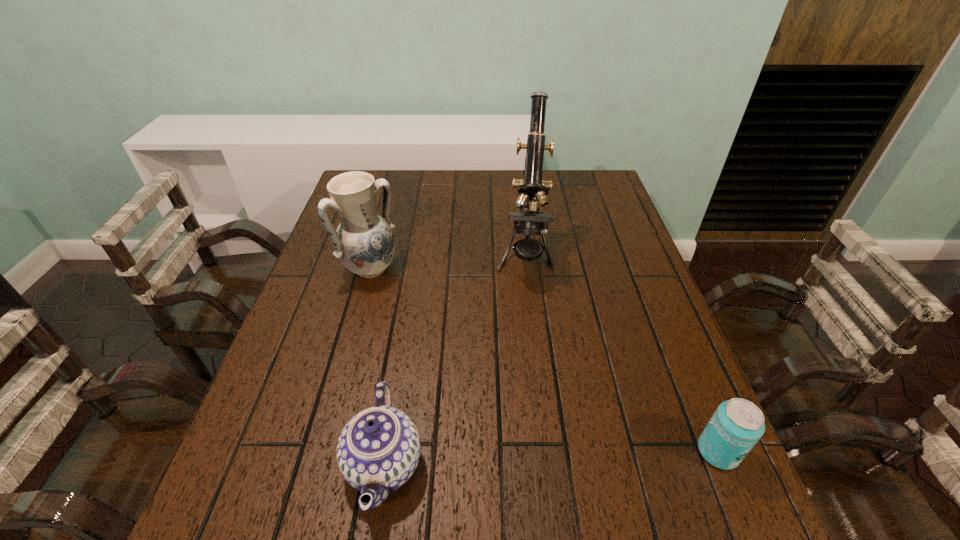
Locate an element on the screen. vacant space situated through the eyepiece of the microscope is located at coordinates (521, 378).

I want to click on vacant space located 0.270m through the eyepiece of the microscope, so click(521, 374).

Find the location of `vacant area situated on either side of the pottery`. vacant area situated on either side of the pottery is located at coordinates (481, 369).

At what (x,y) coordinates should I click in order to perform the action: click on free region located on either side of the pottery. Please return your answer as a coordinate pair (x, y). Looking at the image, I should click on (412, 307).

What are the coordinates of `free region located 0.230m on either side of the pottery` in the screenshot? It's located at [439, 331].

Locate an element on the screen. chinaware located at the near edge is located at coordinates (378, 450).

I want to click on beer can present at the near edge, so click(x=737, y=425).

Find the location of a particular element. object positioned at the left edge is located at coordinates (364, 242).

Image resolution: width=960 pixels, height=540 pixels. Identify the location of object positioned at the right edge. (737, 425).

Locate an element on the screen. This screenshot has width=960, height=540. object that is at the near right corner is located at coordinates (737, 425).